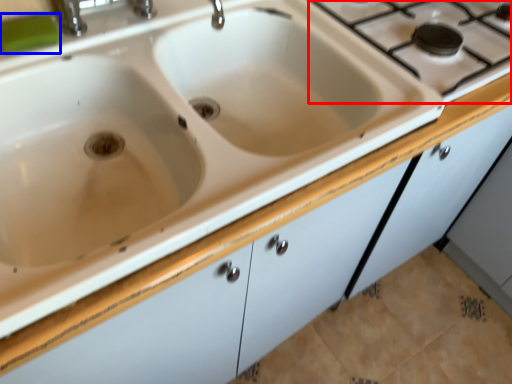
Question: Among these objects, which one is farthest to the camera, gas stove (highlighted by a red box) or soap (highlighted by a blue box)?

Choices:
 (A) gas stove
 (B) soap

Answer: (A)